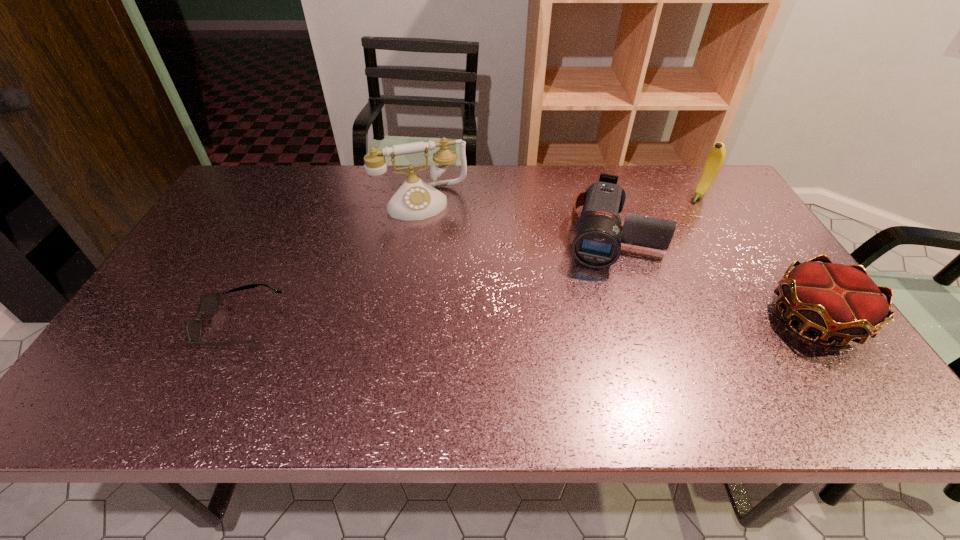
Where is `vacant space at the near edge of the desktop`? The width and height of the screenshot is (960, 540). vacant space at the near edge of the desktop is located at coordinates (437, 358).

This screenshot has width=960, height=540. In the image, there is a desktop. Find the location of `vacant space at the left edge`. vacant space at the left edge is located at coordinates (241, 222).

Where is `vacant area at the right edge`? This screenshot has height=540, width=960. vacant area at the right edge is located at coordinates (771, 264).

Find the location of a particular element. The image size is (960, 540). vacant space at the far left corner of the desktop is located at coordinates (279, 178).

Find the location of a particular element. The height and width of the screenshot is (540, 960). vacant area that lies between the third object from right to left and the sunglasses is located at coordinates (424, 280).

Identify the location of free space between the sunglasses and the crown. The height and width of the screenshot is (540, 960). (528, 322).

This screenshot has height=540, width=960. Find the location of `vacant area between the shortest object and the third object from left to right`. vacant area between the shortest object and the third object from left to right is located at coordinates (424, 280).

Locate an element on the screen. free spot between the banana and the telephone is located at coordinates (561, 199).

Locate an element on the screen. The height and width of the screenshot is (540, 960). vacant space that is in between the third object from left to right and the sunglasses is located at coordinates (424, 280).

You are a GUI agent. You are given a task and a screenshot of the screen. Output one action in this format:
    pyautogui.click(x=<x>, y=<y>)
    Task: Click on the vacant space that is in between the telephone and the third object from left to right
    
    Given the screenshot: What is the action you would take?
    pyautogui.click(x=516, y=218)